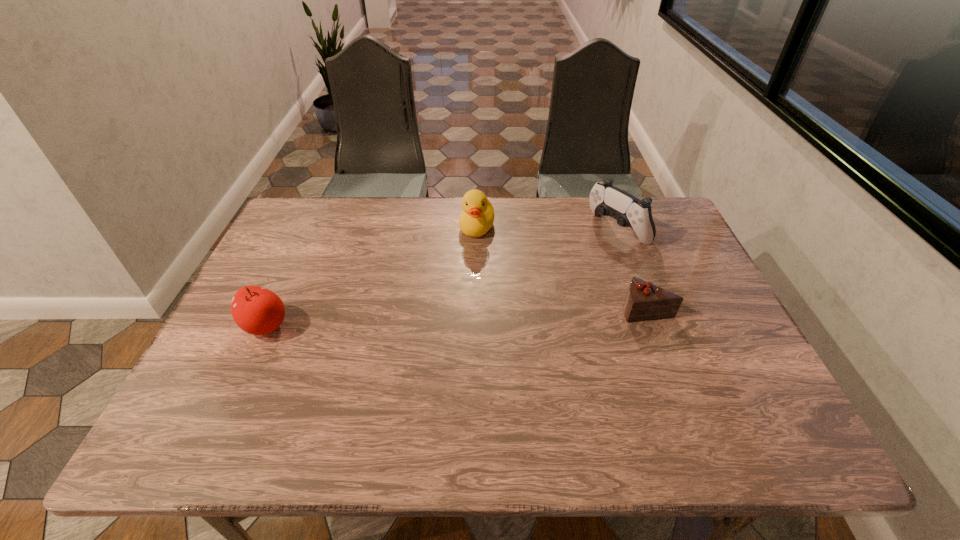
You are a GUI agent. You are given a task and a screenshot of the screen. Output one action in this format:
    pyautogui.click(x=<x>, y=<y>)
    Task: Click on the apple
    This screenshot has height=540, width=960.
    Given the screenshot: What is the action you would take?
    pyautogui.click(x=256, y=310)

Where is `the shortest object`? The width and height of the screenshot is (960, 540). the shortest object is located at coordinates (644, 301).

I want to click on control, so click(607, 200).

The width and height of the screenshot is (960, 540). I want to click on duck, so (477, 217).

The height and width of the screenshot is (540, 960). Identify the location of vacant space situated 0.280m on the back of the apple. (305, 240).

Find the location of a particular element. Image resolution: width=960 pixels, height=540 pixels. blank area located 0.190m on the left of the shortest object is located at coordinates (547, 309).

This screenshot has height=540, width=960. Identify the location of vacant region located 0.300m on the front-facing side of the control. (526, 287).

I want to click on vacant area situated on the front-facing side of the control, so click(566, 262).

Locate an element on the screen. The width and height of the screenshot is (960, 540). blank space located on the front-facing side of the control is located at coordinates (549, 272).

Locate an element on the screen. This screenshot has width=960, height=540. vacant region located at the beak of the duck is located at coordinates (439, 317).